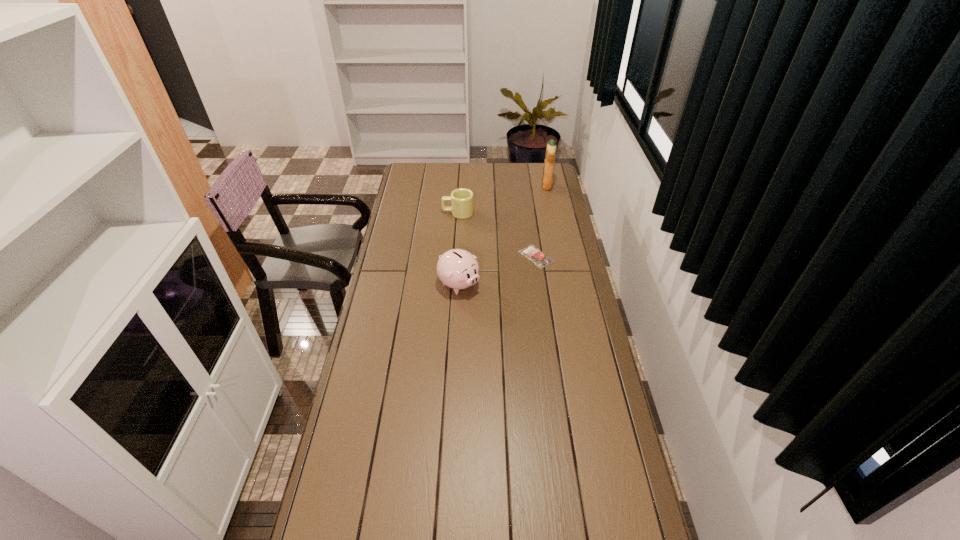
Locate an element on the screen. vacant space located on the label of the rightmost object is located at coordinates (490, 186).

I want to click on free space located 0.190m on the back of the nearest object, so click(x=461, y=242).

Locate an element on the screen. free region located 0.140m with the handle on the side of the second shortest object is located at coordinates (414, 213).

Where is `free spot located with the handle on the side of the second shortest object`? The height and width of the screenshot is (540, 960). free spot located with the handle on the side of the second shortest object is located at coordinates (416, 213).

Where is `vacant region located with the handle on the side of the second shortest object`? This screenshot has width=960, height=540. vacant region located with the handle on the side of the second shortest object is located at coordinates (406, 213).

Where is `free point located on the back of the second object from right to left`? Image resolution: width=960 pixels, height=540 pixels. free point located on the back of the second object from right to left is located at coordinates (531, 220).

Identify the location of object present at the far edge. The width and height of the screenshot is (960, 540). [x=547, y=178].

Identify the location of detergent situated at the right edge. This screenshot has height=540, width=960. pos(547,178).

This screenshot has width=960, height=540. In order to click on steak at the right edge in this screenshot , I will do `click(540, 259)`.

Find the location of `object at the far right corner`. object at the far right corner is located at coordinates (547, 178).